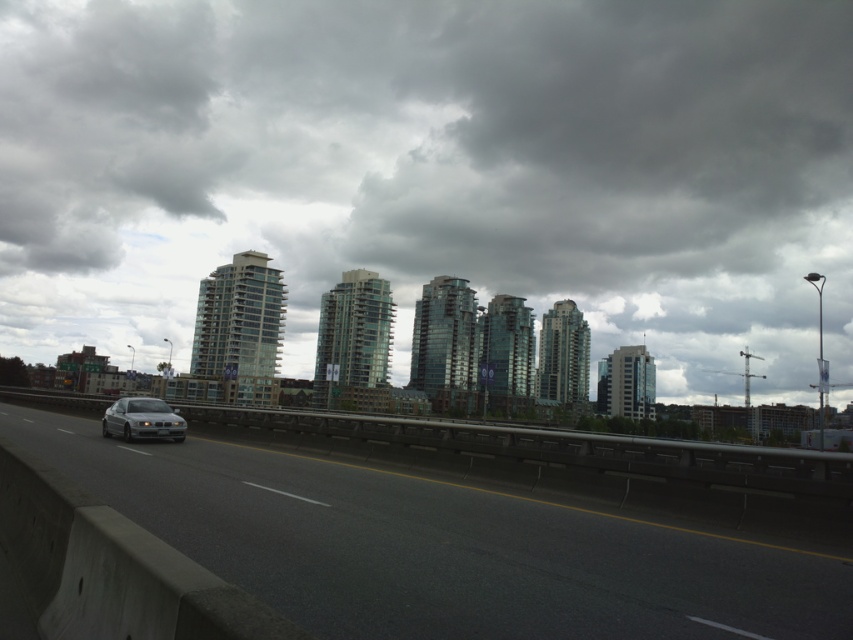
You are a drone operator trying to fly your drone from the gray asphalt highway at center to the sleek silver sedan at left. Considering the height difference between them, will your drone need to ascend or descend to reach the sedan from the highway?

The gray asphalt highway at center has a lesser height compared to the sleek silver sedan at left. Therefore, the drone will need to ascend to reach the sedan from the highway.

From the picture: You are a pedestrian standing on the sidewalk next to the gray asphalt highway at center. You want to cross the road to reach the sleek silver sedan at left. Is the highway above the sedan, making it unsafe to cross directly?

The gray asphalt highway at center is located above the sleek silver sedan at left, so crossing directly would be unsafe as the highway is elevated over the sedan.